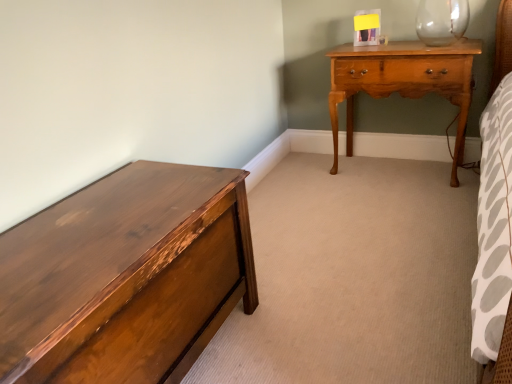
Question: Does light brown wood nightstand at upper right turn towards shiny brown wood chest of drawers at left?

Choices:
 (A) no
 (B) yes

Answer: (B)

Question: Considering the relative positions of light brown wood nightstand at upper right and shiny brown wood chest of drawers at left in the image provided, is light brown wood nightstand at upper right to the left of shiny brown wood chest of drawers at left from the viewer's perspective?

Choices:
 (A) yes
 (B) no

Answer: (B)

Question: Is light brown wood nightstand at upper right closer to camera compared to shiny brown wood chest of drawers at left?

Choices:
 (A) yes
 (B) no

Answer: (B)

Question: Is light brown wood nightstand at upper right taller than shiny brown wood chest of drawers at left?

Choices:
 (A) no
 (B) yes

Answer: (B)

Question: From a real-world perspective, is light brown wood nightstand at upper right under shiny brown wood chest of drawers at left?

Choices:
 (A) yes
 (B) no

Answer: (B)

Question: Does light brown wood nightstand at upper right have a lesser height compared to shiny brown wood chest of drawers at left?

Choices:
 (A) yes
 (B) no

Answer: (B)

Question: From the image's perspective, is shiny brown wood chest of drawers at left under light brown wood nightstand at upper right?

Choices:
 (A) no
 (B) yes

Answer: (B)

Question: Does shiny brown wood chest of drawers at left turn towards light brown wood nightstand at upper right?

Choices:
 (A) no
 (B) yes

Answer: (A)

Question: Is shiny brown wood chest of drawers at left behind light brown wood nightstand at upper right?

Choices:
 (A) no
 (B) yes

Answer: (A)

Question: Does shiny brown wood chest of drawers at left have a greater width compared to light brown wood nightstand at upper right?

Choices:
 (A) yes
 (B) no

Answer: (A)

Question: Can light brown wood nightstand at upper right be found inside shiny brown wood chest of drawers at left?

Choices:
 (A) yes
 (B) no

Answer: (B)

Question: From a real-world perspective, is shiny brown wood chest of drawers at left under light brown wood nightstand at upper right?

Choices:
 (A) no
 (B) yes

Answer: (B)

Question: From the image's perspective, is shiny brown wood chest of drawers at left positioned above or below light brown wood nightstand at upper right?

Choices:
 (A) below
 (B) above

Answer: (A)